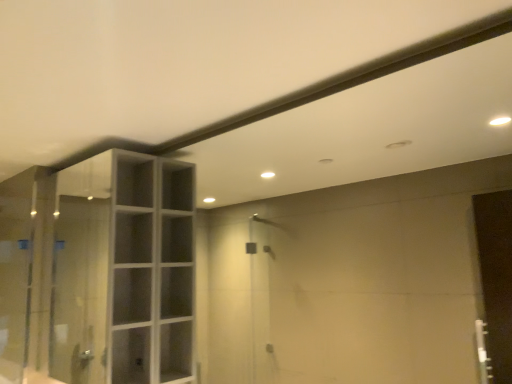
At what (x,y) coordinates should I click in order to perform the action: click on clear glass cabinet at left. Please return your answer as a coordinate pair (x, y). The width and height of the screenshot is (512, 384). Looking at the image, I should click on (124, 271).

What do you see at coordinates (124, 271) in the screenshot? The height and width of the screenshot is (384, 512). I see `clear glass cabinet at left` at bounding box center [124, 271].

Where is `clear glass cabinet at left`? This screenshot has width=512, height=384. clear glass cabinet at left is located at coordinates (124, 271).